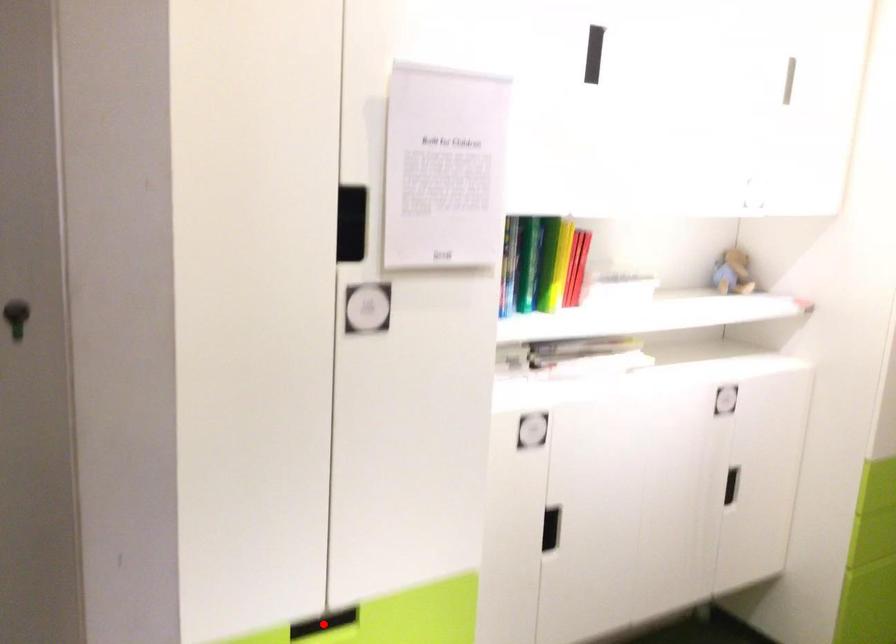
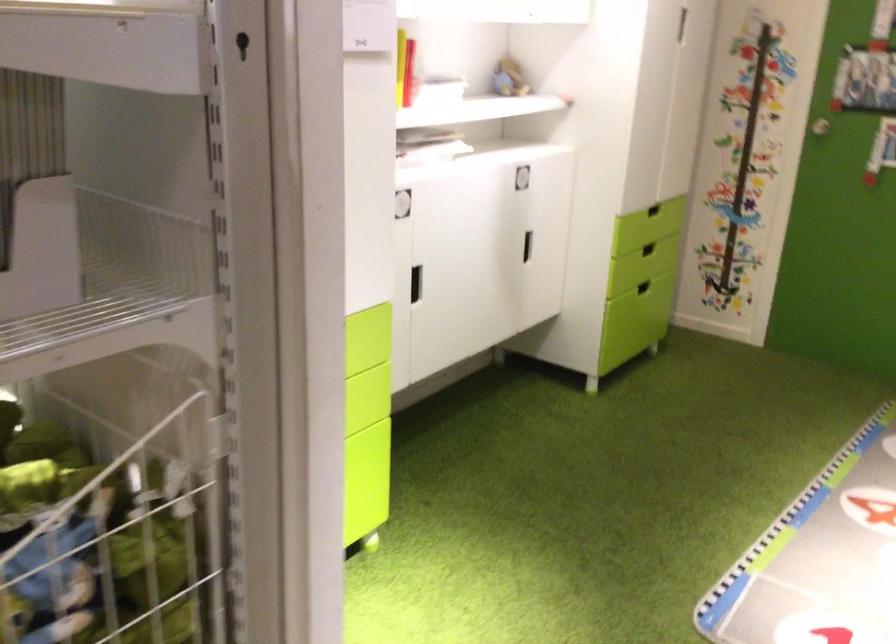
Question: I am providing you with two images of the same scene from different viewpoints. A red point is marked on the first image. Is the red point's position out of view in image 2?

Choices:
 (A) Yes
 (B) No

Answer: (A)